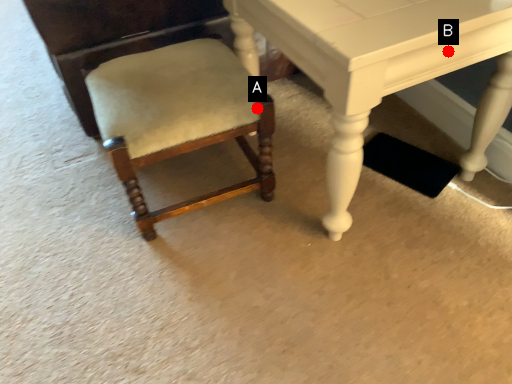
Question: Two points are circled on the image, labeled by A and B beside each circle. Which of the following is the closest to the observer?

Choices:
 (A) A is closer
 (B) B is closer

Answer: (B)